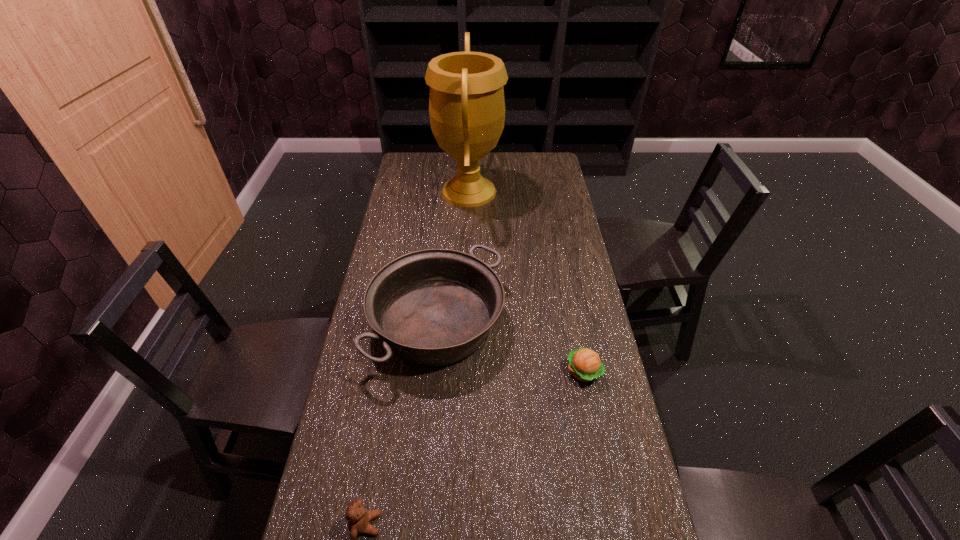
Identify the location of object situated at the right edge. The image size is (960, 540). (585, 365).

Identify the location of blank space at the far edge of the desktop. coord(518,157).

Locate an element on the screen. free space at the left edge of the desktop is located at coordinates (364, 321).

What are the coordinates of `vacant area at the right edge of the desktop` in the screenshot? It's located at (618, 451).

This screenshot has height=540, width=960. Find the location of `vacant area that lies between the tallest object and the shortest object`. vacant area that lies between the tallest object and the shortest object is located at coordinates [526, 281].

You are a GUI agent. You are given a task and a screenshot of the screen. Output one action in this format:
    pyautogui.click(x=<x>, y=<y>)
    Task: Click on the free area in between the hamburger and the farthest object
    The width and height of the screenshot is (960, 540).
    Given the screenshot: What is the action you would take?
    pyautogui.click(x=526, y=281)

You are a GUI agent. You are given a task and a screenshot of the screen. Output one action in this format:
    pyautogui.click(x=<x>, y=<y>)
    Task: Click on the vacant point located between the trophy and the hamburger
    The image size is (960, 540).
    Given the screenshot: What is the action you would take?
    pyautogui.click(x=526, y=281)

Where is `free area in between the hamburger and the third shortest object`? free area in between the hamburger and the third shortest object is located at coordinates (511, 347).

Find the location of a particular element. Image resolution: width=960 pixels, height=540 pixels. free space between the farthest object and the rightmost object is located at coordinates (526, 281).

Identify the location of free area in between the rightmost object and the pan. The width and height of the screenshot is (960, 540). coord(511,347).